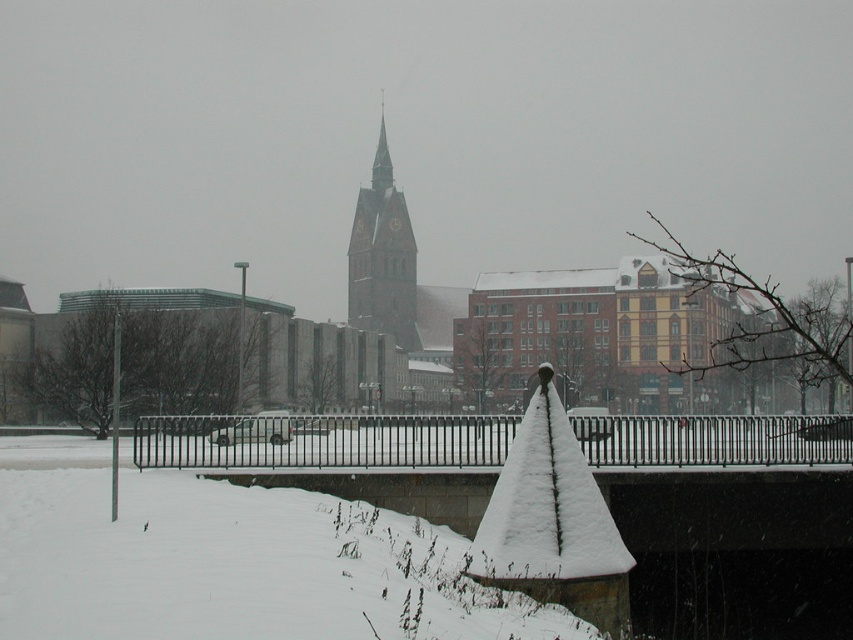
Question: Is black metal fence at center to the right of brown stone clock tower at center from the viewer's perspective?

Choices:
 (A) no
 (B) yes

Answer: (B)

Question: Can you confirm if black metal fence at center is positioned below brown stone clock tower at center?

Choices:
 (A) yes
 (B) no

Answer: (A)

Question: Can you confirm if black metal fence at center is positioned to the right of brown stone clock tower at center?

Choices:
 (A) yes
 (B) no

Answer: (A)

Question: Which of the following is the farthest from the observer?

Choices:
 (A) (410, 262)
 (B) (627, 477)

Answer: (A)